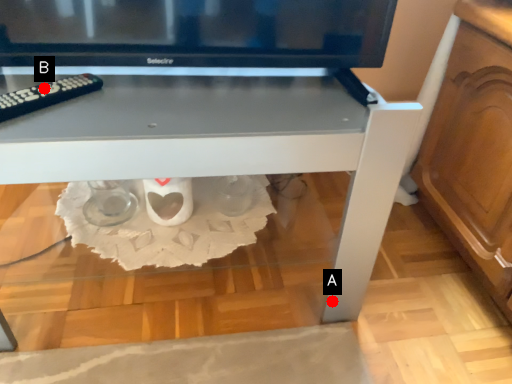
Question: Two points are circled on the image, labeled by A and B beside each circle. Which point is farther from the camera taking this photo?

Choices:
 (A) A is further
 (B) B is further

Answer: (A)